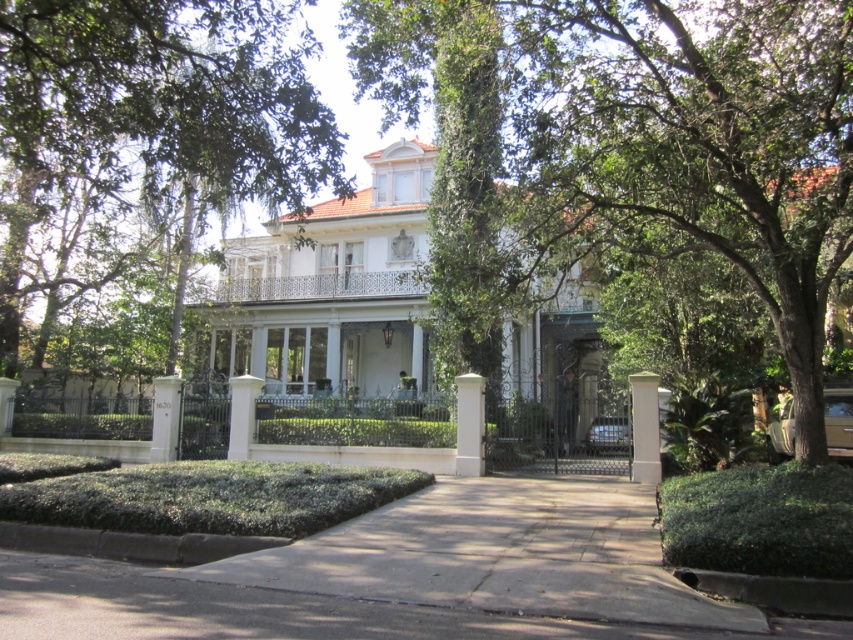
Question: Is green leafy tree at center positioned before white glossy mansion at center?

Choices:
 (A) no
 (B) yes

Answer: (B)

Question: Among these objects, which one is farthest from the camera?

Choices:
 (A) paved concrete driveway at center
 (B) white painted concrete pillar at lower left

Answer: (B)

Question: Does paved concrete driveway at center appear under white smooth column at center?

Choices:
 (A) no
 (B) yes

Answer: (B)

Question: Does green leafy tree at center appear on the right side of green leafy tree at upper center?

Choices:
 (A) no
 (B) yes

Answer: (B)

Question: Which of the following is the closest to the observer?

Choices:
 (A) paved concrete driveway at center
 (B) white painted concrete pillar at lower left

Answer: (A)

Question: Which is nearer to the green leafy tree at center?

Choices:
 (A) paved concrete driveway at center
 (B) white smooth column at center
 (C) white smooth pillar at center
 (D) white glossy mansion at center

Answer: (B)